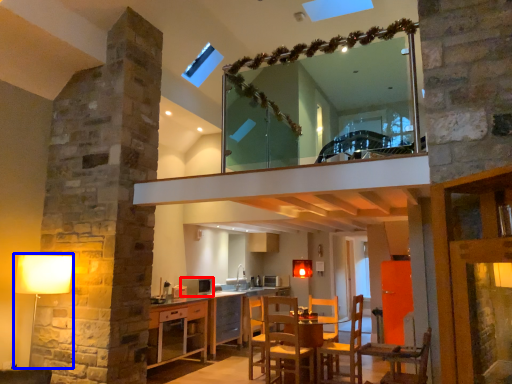
Question: Among these objects, which one is nearest to the camera, appliance (highlighted by a red box) or table lamp (highlighted by a blue box)?

Choices:
 (A) appliance
 (B) table lamp

Answer: (B)